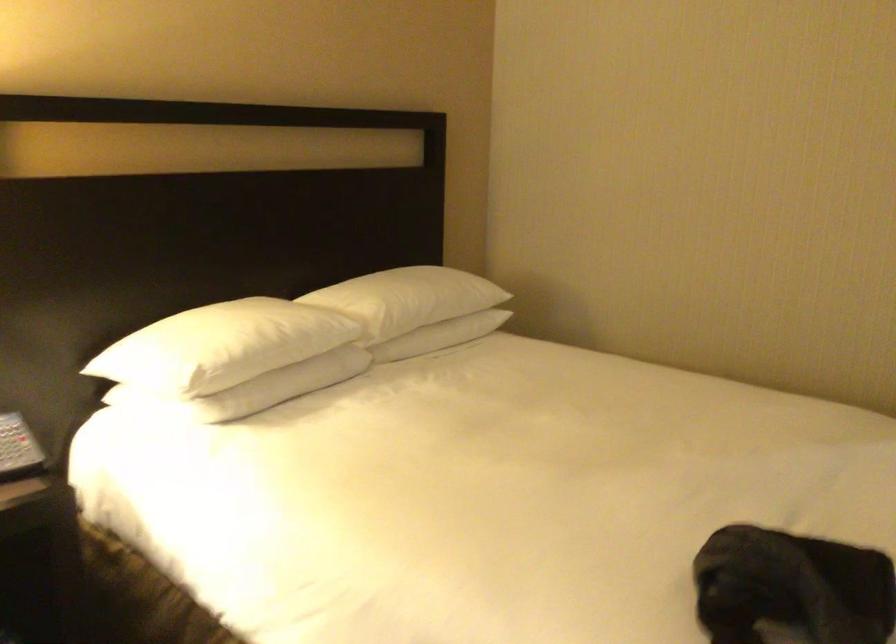
Where is `telephone button`? The image size is (896, 644). telephone button is located at coordinates (15, 448).